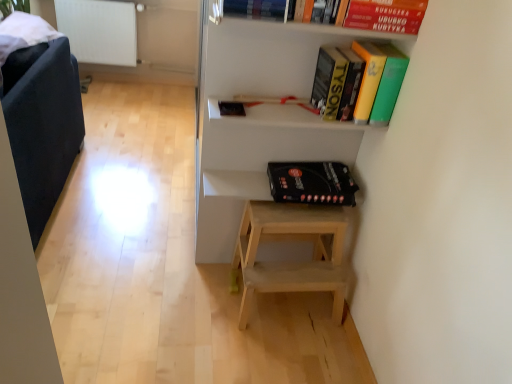
Question: From a real-world perspective, does white matte shelf at upper center sit lower than dark blue fabric armchair at left?

Choices:
 (A) yes
 (B) no

Answer: (B)

Question: Can you confirm if white matte shelf at upper center is shorter than dark blue fabric armchair at left?

Choices:
 (A) no
 (B) yes

Answer: (A)

Question: From a real-world perspective, is white matte shelf at upper center physically above dark blue fabric armchair at left?

Choices:
 (A) yes
 (B) no

Answer: (A)

Question: Is white matte shelf at upper center not inside dark blue fabric armchair at left?

Choices:
 (A) yes
 (B) no

Answer: (A)

Question: Is white matte shelf at upper center facing away from dark blue fabric armchair at left?

Choices:
 (A) yes
 (B) no

Answer: (B)

Question: Considering the relative sizes of white matte shelf at upper center and dark blue fabric armchair at left in the image provided, is white matte shelf at upper center bigger than dark blue fabric armchair at left?

Choices:
 (A) no
 (B) yes

Answer: (A)

Question: Can you confirm if yellow matte book at upper center, which ranks as the 2th book in left-to-right order, is shorter than black matte board game at center, which is counted as the 2th paperback book, starting from the front?

Choices:
 (A) yes
 (B) no

Answer: (B)

Question: Is black matte board game at center, arranged as the 2th paperback book when viewed from the top, inside yellow matte book at upper center, the 1th book when ordered from bottom to top?

Choices:
 (A) no
 (B) yes

Answer: (A)

Question: Is yellow matte book at upper center, the 1th book when ordered from bottom to top, positioned with its back to black matte board game at center, arranged as the 2th paperback book when viewed from the top?

Choices:
 (A) no
 (B) yes

Answer: (A)

Question: Can you confirm if yellow matte book at upper center, which ranks as the 2th book in left-to-right order, is thinner than black matte board game at center, the 1th paperback book in the bottom-to-top sequence?

Choices:
 (A) yes
 (B) no

Answer: (A)

Question: Does yellow matte book at upper center, which ranks as the 2th book in left-to-right order, have a greater height compared to black matte board game at center, the first paperback book positioned from the back?

Choices:
 (A) no
 (B) yes

Answer: (B)

Question: Is yellow matte book at upper center, the first book from the right, wider than black matte board game at center, arranged as the 2th paperback book when viewed from the top?

Choices:
 (A) no
 (B) yes

Answer: (A)

Question: Is hardcover book at upper center, placed as the first book when sorted from top to bottom, completely or partially inside white matte shelf at upper center?

Choices:
 (A) yes
 (B) no

Answer: (A)